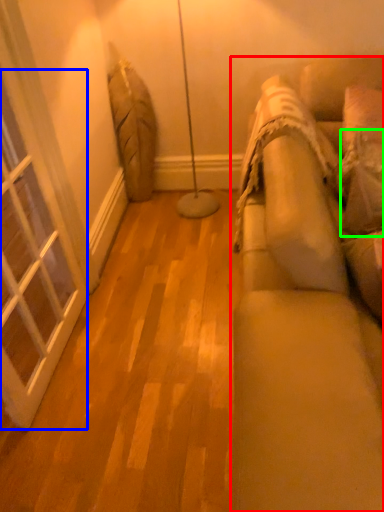
Question: Which object is positioned closest to studio couch (highlighted by a red box)? Select from window (highlighted by a blue box) and pillow (highlighted by a green box).

Choices:
 (A) window
 (B) pillow

Answer: (B)